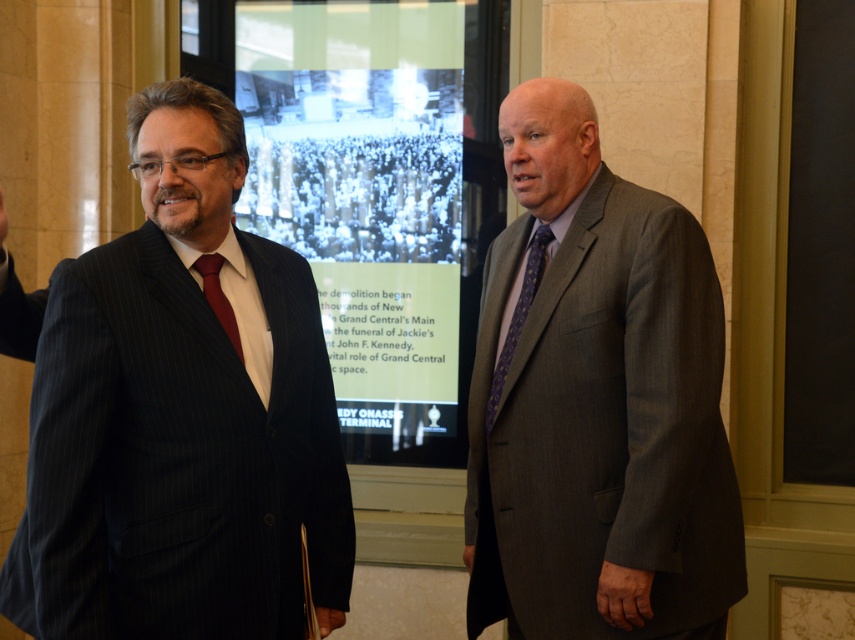
You are a photographer setting up for an event. You need to position a camera so that both the gray pinstripe suit at right and the blackboard at right are in frame. Based on their heights, which object will appear taller in the photo?

The blackboard at right will appear taller in the photo because it is taller than the gray pinstripe suit at right according to the description.

You are organizing a formal event and need to ensure that the gray pinstripe suit at right and the matte red tie at left are visible to all attendees. Given their sizes, which one is more likely to be easily seen from the back of the room?

The gray pinstripe suit at right is larger in size than the matte red tie at left, so it is more likely to be easily seen from the back of the room.

In the scene shown: You are standing in front of the large screen displaying a black and white photograph. You want to move to the gray pinstripe suit at right without walking through the man on the left. Which direction should you move first?

To avoid walking through the man on the left, you should move to the right first since the gray pinstripe suit at right is located at point (596, 401), which is to the right side of the scene.